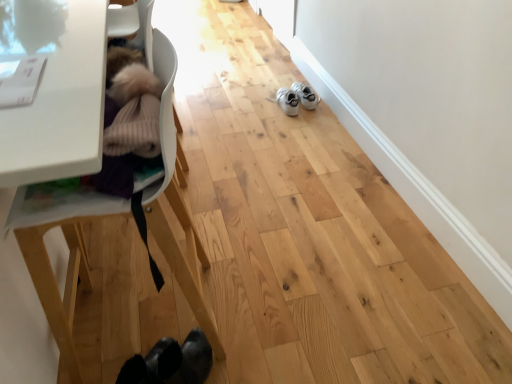
Question: In terms of size, does white plastic baby carriage at left appear bigger or smaller than white suede shoes at center?

Choices:
 (A) big
 (B) small

Answer: (A)

Question: Is white plastic baby carriage at left taller or shorter than white suede shoes at center?

Choices:
 (A) tall
 (B) short

Answer: (A)

Question: Considering the positions of white plastic baby carriage at left and white suede shoes at center in the image, is white plastic baby carriage at left wider or thinner than white suede shoes at center?

Choices:
 (A) wide
 (B) thin

Answer: (A)

Question: Would you say white suede shoes at center is inside or outside white plastic baby carriage at left?

Choices:
 (A) outside
 (B) inside

Answer: (A)

Question: Considering their positions, is white suede shoes at center located in front of or behind white plastic baby carriage at left?

Choices:
 (A) front
 (B) behind

Answer: (B)

Question: Visually, is white suede shoes at center positioned to the left or to the right of white plastic baby carriage at left?

Choices:
 (A) right
 (B) left

Answer: (A)

Question: Does point (309, 104) appear closer or farther from the camera than point (162, 178)?

Choices:
 (A) farther
 (B) closer

Answer: (A)